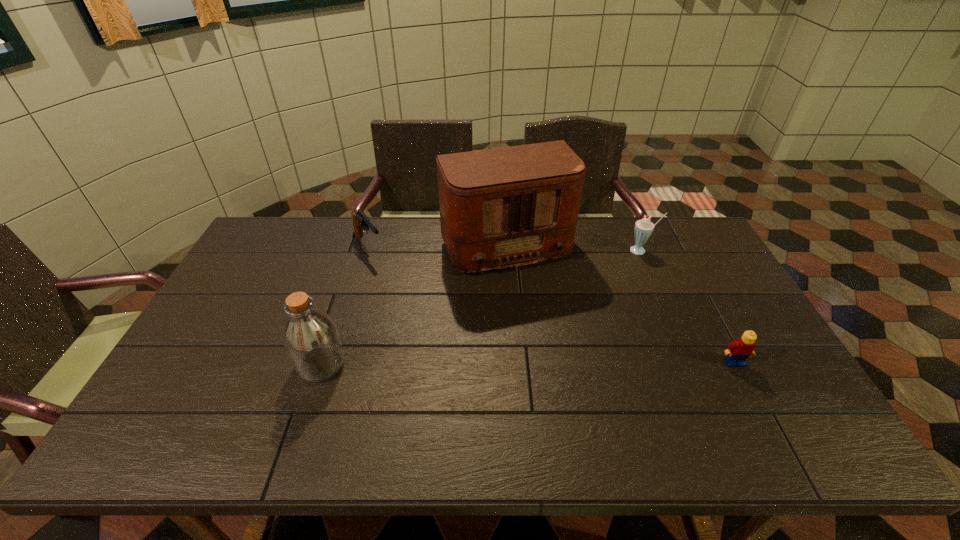
At what (x,y) coordinates should I click in order to perform the action: click on milkshake that is at the far edge. Please return your answer as a coordinate pair (x, y). The image size is (960, 540). Looking at the image, I should click on (643, 228).

This screenshot has width=960, height=540. I want to click on object at the near edge, so click(310, 337).

Locate an element on the screen. object positioned at the right edge is located at coordinates (738, 351).

In the image, there is a desktop. Where is `vacant region at the far edge`? vacant region at the far edge is located at coordinates (380, 227).

At what (x,y) coordinates should I click in order to perform the action: click on vacant region at the near edge of the desktop. Please return your answer as a coordinate pair (x, y). Looking at the image, I should click on click(312, 404).

Locate an element on the screen. This screenshot has width=960, height=540. vacant space at the left edge is located at coordinates (275, 293).

Where is `vacant space at the right edge of the desktop`? vacant space at the right edge of the desktop is located at coordinates (699, 322).

In the image, there is a desktop. Where is `vacant space at the far left corner`? Image resolution: width=960 pixels, height=540 pixels. vacant space at the far left corner is located at coordinates (288, 240).

In the image, there is a desktop. Identify the location of vacant region at the far right corner. (696, 256).

Where is `empty space that is in between the gun and the bottle`? empty space that is in between the gun and the bottle is located at coordinates (345, 305).